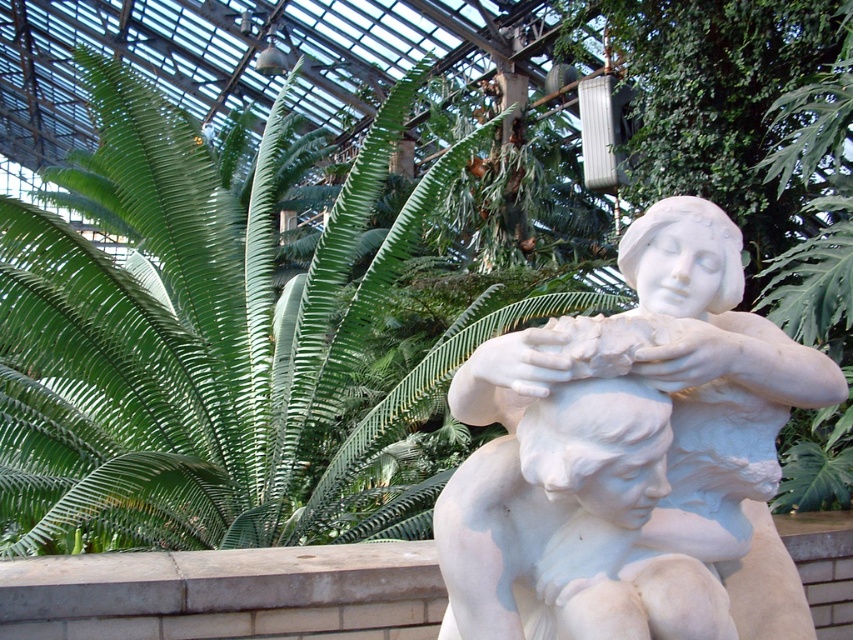
Question: Does green leafy fern at center have a lesser width compared to white marble sculpture at center?

Choices:
 (A) no
 (B) yes

Answer: (A)

Question: Which of the following is the farthest from the observer?

Choices:
 (A) pyautogui.click(x=148, y=131)
 (B) pyautogui.click(x=741, y=280)

Answer: (A)

Question: Which point is farther to the camera?

Choices:
 (A) green leafy fern at center
 (B) white marble sculpture at center

Answer: (A)

Question: Does green leafy fern at center appear on the left side of white marble sculpture at center?

Choices:
 (A) no
 (B) yes

Answer: (B)

Question: Does green leafy fern at center have a larger size compared to white marble sculpture at center?

Choices:
 (A) yes
 (B) no

Answer: (A)

Question: Which point is closer to the camera taking this photo?

Choices:
 (A) (352, 328)
 (B) (793, 346)

Answer: (B)